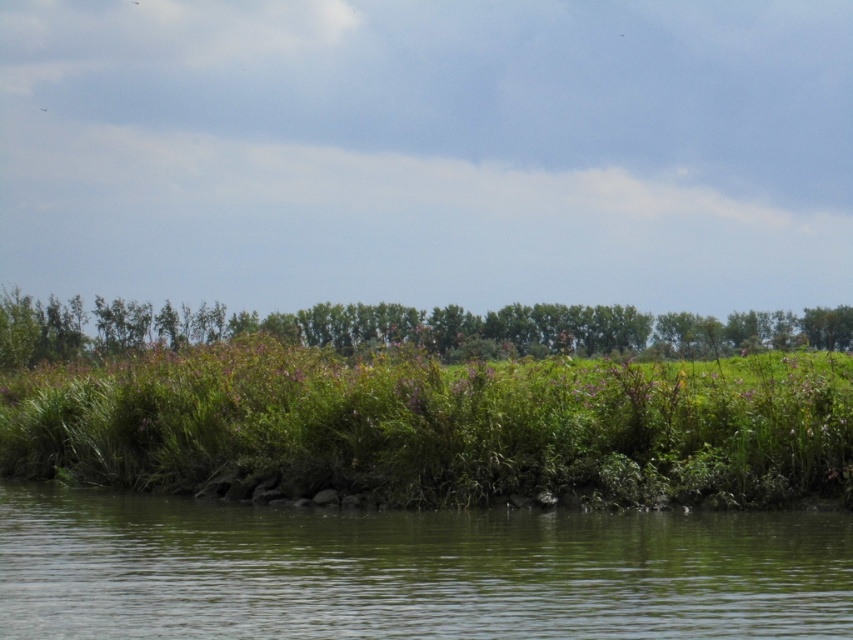
Question: In this image, where is green smooth water at lower center located relative to green leafy trees at upper center?

Choices:
 (A) right
 (B) left

Answer: (A)

Question: Which object is farther from the camera taking this photo?

Choices:
 (A) green smooth water at lower center
 (B) green leafy trees at upper center

Answer: (B)

Question: Can you confirm if green smooth water at lower center is thinner than green leafy trees at upper center?

Choices:
 (A) no
 (B) yes

Answer: (B)

Question: Which of the following is the closest to the observer?

Choices:
 (A) green leafy trees at upper center
 (B) green smooth water at lower center

Answer: (B)

Question: Which object is farther from the camera taking this photo?

Choices:
 (A) green leafy trees at upper center
 (B) green smooth water at lower center

Answer: (A)

Question: Can you confirm if green smooth water at lower center is positioned above green leafy trees at upper center?

Choices:
 (A) yes
 (B) no

Answer: (B)